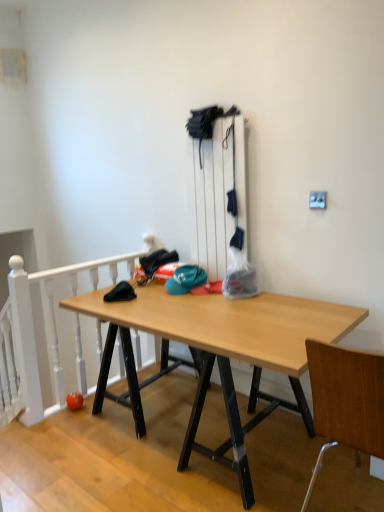
Find the location of a particular element. This screenshot has width=384, height=512. vacant position to the left of wooden at right is located at coordinates click(x=249, y=490).